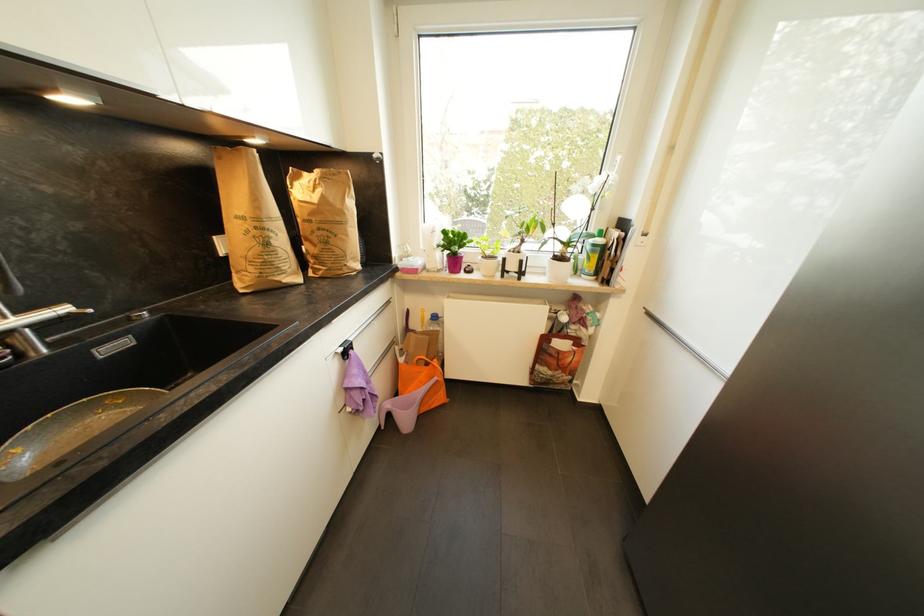
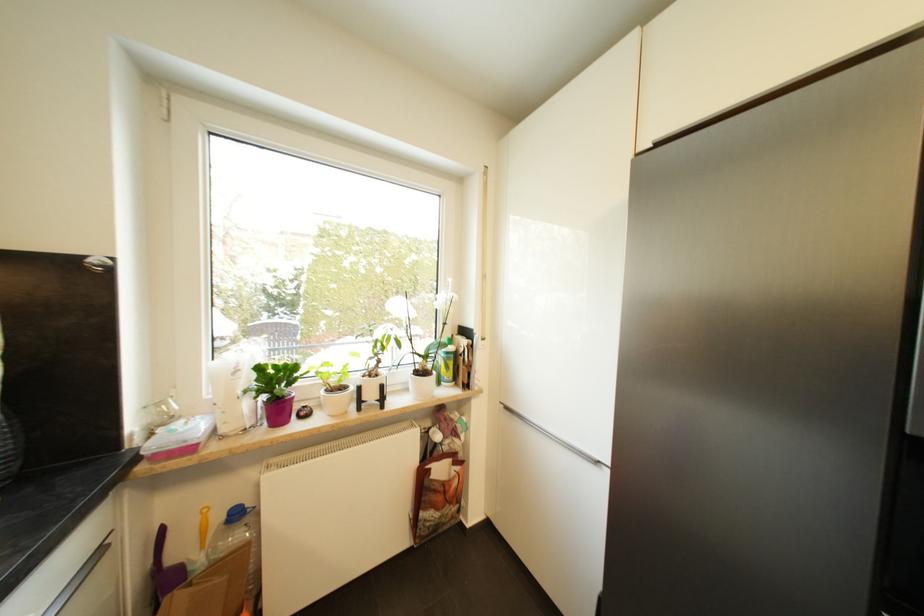
Question: I am providing you with two images of the same scene from different viewpoints. Which of the following objects are not visible in image2?

Choices:
 (A) yellow plastic tool
 (B) pink container lid
 (C) green spray bottle
 (D) none of these

Answer: (D)